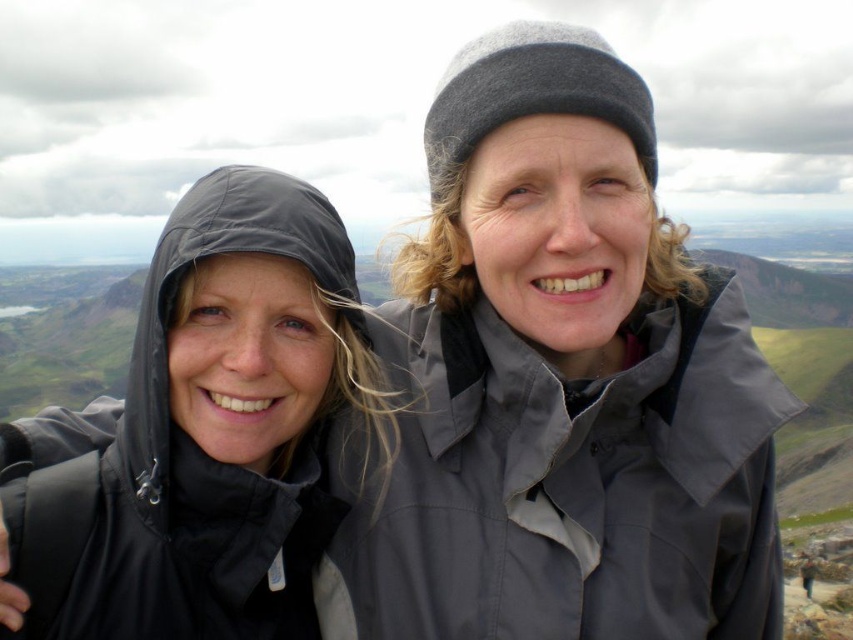
What do you see at coordinates (560, 381) in the screenshot?
I see `matte gray jacket at center` at bounding box center [560, 381].

Does point (647, 561) come farther from viewer compared to point (323, 458)?

No, it is in front of (323, 458).

The height and width of the screenshot is (640, 853). What are the coordinates of `matte gray jacket at center` in the screenshot? It's located at (560, 381).